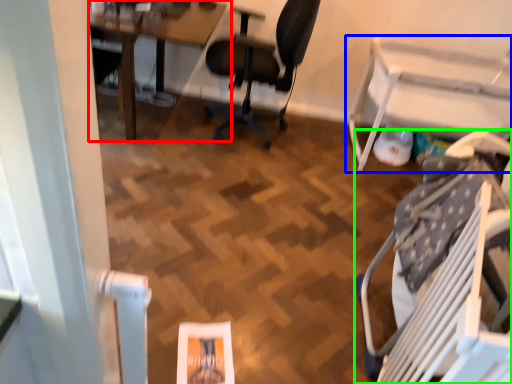
Question: Considering the real-world distances, which object is farthest from table (highlighted by a red box)? table (highlighted by a blue box) or chair (highlighted by a green box)?

Choices:
 (A) table
 (B) chair

Answer: (B)